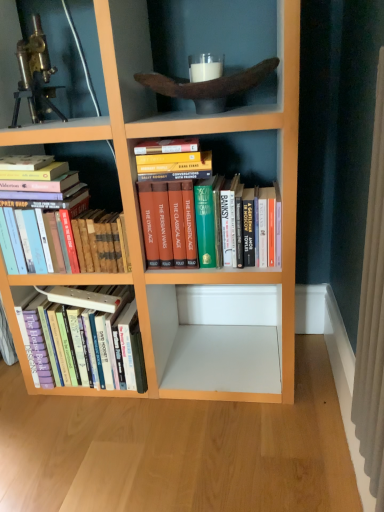
Identify the location of free spot in front of hardcover books at left, the third book from the top. This screenshot has width=384, height=512. (88, 433).